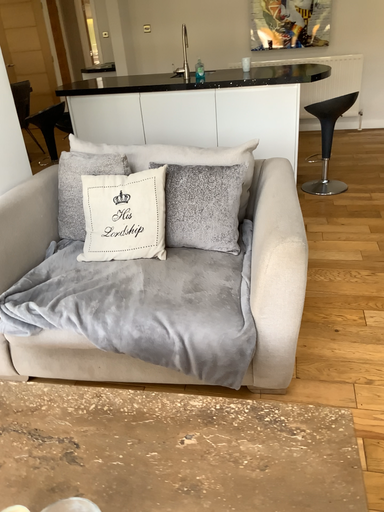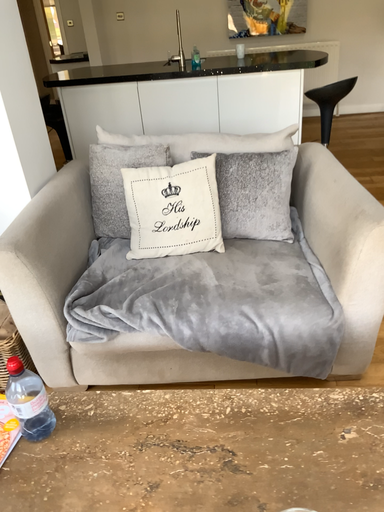
Question: Which way did the camera rotate in the video?

Choices:
 (A) rotated left
 (B) rotated right

Answer: (B)